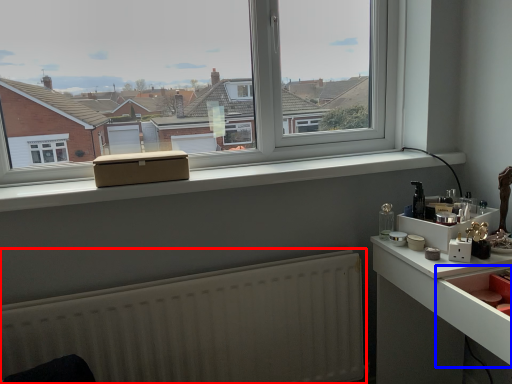
Question: Which point is further to the camera, radiator (highlighted by a red box) or drawer (highlighted by a blue box)?

Choices:
 (A) radiator
 (B) drawer

Answer: (A)